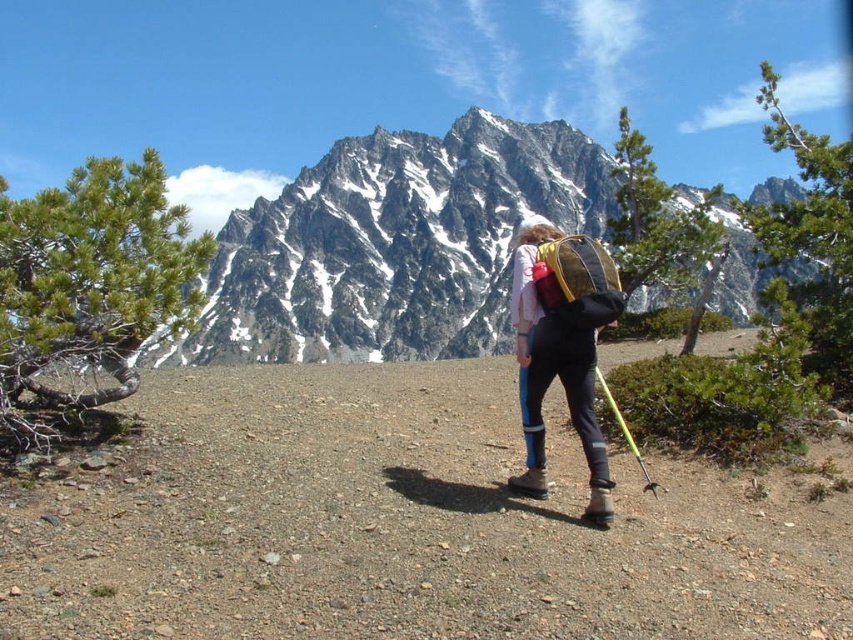
Is snowy granite mountain at upper center thinner than matte black pants at center?

No.

Which is more to the left, snowy granite mountain at upper center or matte black pants at center?

Positioned to the left is matte black pants at center.

Describe the element at coordinates (392, 244) in the screenshot. The image size is (853, 640). I see `snowy granite mountain at upper center` at that location.

The image size is (853, 640). In order to click on snowy granite mountain at upper center in this screenshot , I will do `click(392, 244)`.